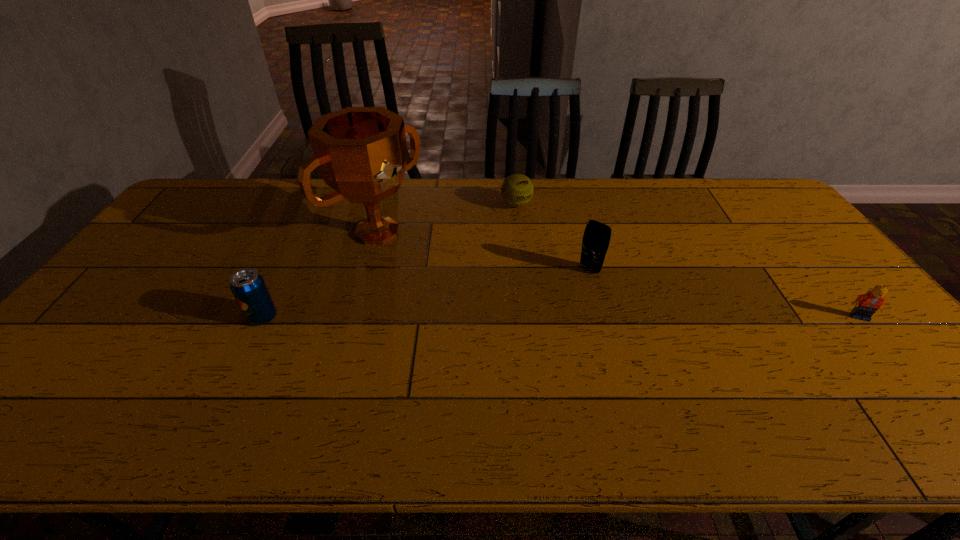
Find the location of `blank space located on the screen of the cellular telephone`. blank space located on the screen of the cellular telephone is located at coordinates [x=513, y=354].

Image resolution: width=960 pixels, height=540 pixels. I want to click on free spot located on the screen of the cellular telephone, so tap(568, 292).

The width and height of the screenshot is (960, 540). What are the coordinates of `free space located 0.120m on the screen of the cellular telephone` in the screenshot? It's located at (563, 299).

Identify the location of vacant position located 0.230m on the logo side of the softball. The width and height of the screenshot is (960, 540). (562, 251).

I want to click on vacant region located on the logo side of the softball, so click(564, 252).

This screenshot has width=960, height=540. In order to click on vacant space located on the logo side of the softball in this screenshot , I will do `click(585, 274)`.

Where is `vacant space situated 0.140m on the side of the award with the star emblem`? vacant space situated 0.140m on the side of the award with the star emblem is located at coordinates (435, 274).

Locate an element on the screen. free space located 0.140m on the side of the award with the star emblem is located at coordinates (435, 274).

Where is `free space located 0.230m on the side of the award with the star emblem`? Image resolution: width=960 pixels, height=540 pixels. free space located 0.230m on the side of the award with the star emblem is located at coordinates (456, 289).

I want to click on softball located at the far edge, so click(517, 190).